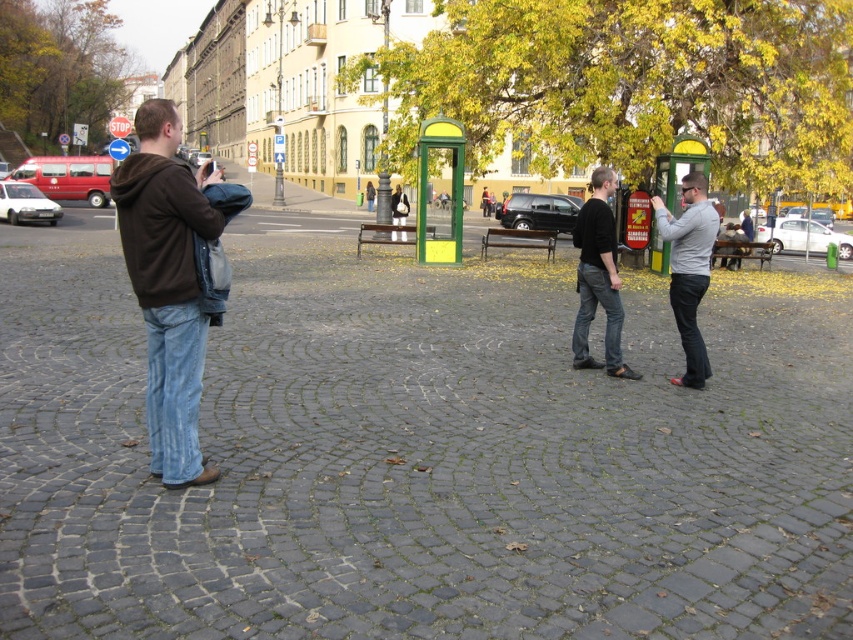
Which is more to the left, gray matte shirt at center or black matte shirt at center?

black matte shirt at center

Which is behind, point (676, 257) or point (636, 378)?

The point (636, 378) is behind.

Between point (671, 266) and point (618, 348), which one is positioned behind?

The point (618, 348) is behind.

Where is `gray matte shirt at center`? This screenshot has width=853, height=640. gray matte shirt at center is located at coordinates (689, 269).

Does brown hoodie at left have a lesser height compared to gray matte shirt at center?

Incorrect, brown hoodie at left's height does not fall short of gray matte shirt at center's.

Looking at this image, who is more distant from viewer, (143,202) or (703,189)?

The point (703,189) is more distant.

Identify the location of brown hoodie at left. (170, 282).

I want to click on brown hoodie at left, so click(170, 282).

Is point (177, 170) in front of point (596, 269)?

Yes.

In the scene shown: Is brown hoodie at left above black matte shirt at center?

Indeed, brown hoodie at left is positioned over black matte shirt at center.

The width and height of the screenshot is (853, 640). Describe the element at coordinates (170, 282) in the screenshot. I see `brown hoodie at left` at that location.

You are a GUI agent. You are given a task and a screenshot of the screen. Output one action in this format:
    pyautogui.click(x=<x>, y=<y>)
    Task: Click on the brown hoodie at left
    The width and height of the screenshot is (853, 640).
    Given the screenshot: What is the action you would take?
    pyautogui.click(x=170, y=282)